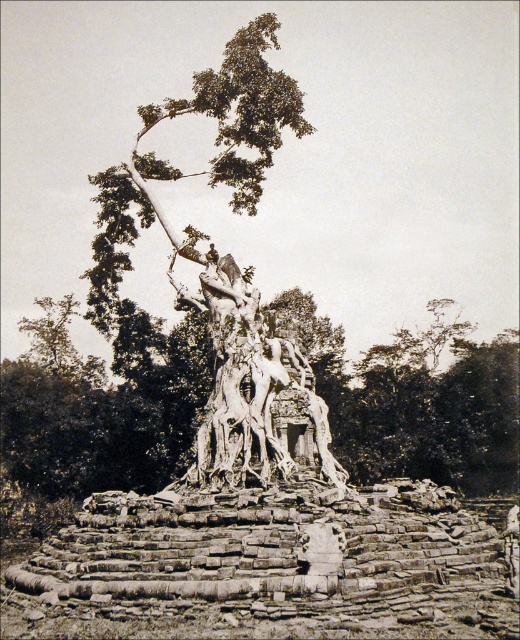
You are an archaeologist examining the ancient ruins and notice the rough bark tree trunk at center and the stone statue at center. Which object is closer to you as you stand in front of the ruins?

The rough bark tree trunk at center is closer to you than the stone statue at center because it is positioned further to the viewer in the image.